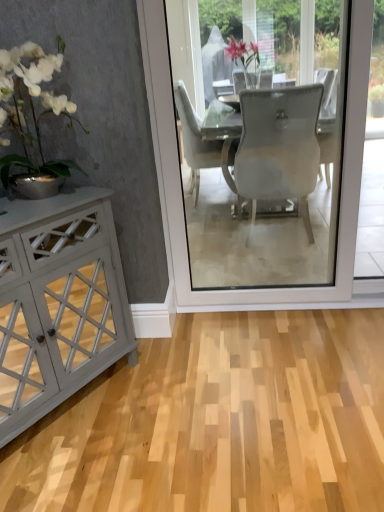
I want to click on vacant space in front of matte gray cabinet at left, so click(x=77, y=471).